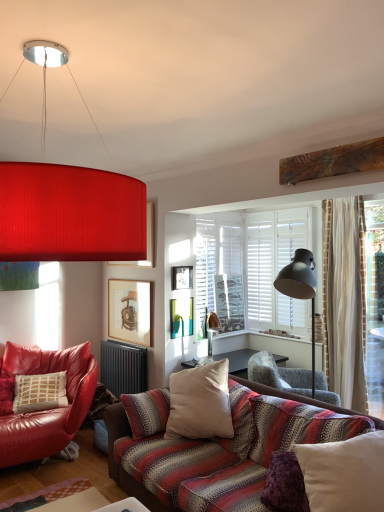
Question: Can you confirm if black metallic radiator at lower center is taller than striped fabric chair at center, which is the second chair from left to right?

Choices:
 (A) yes
 (B) no

Answer: (A)

Question: Are black metallic radiator at lower center and striped fabric chair at center, arranged as the first chair when viewed from the right, making contact?

Choices:
 (A) yes
 (B) no

Answer: (B)

Question: From a real-world perspective, is black metallic radiator at lower center positioned under striped fabric chair at center, which is the second chair from left to right, based on gravity?

Choices:
 (A) no
 (B) yes

Answer: (B)

Question: Can you confirm if black metallic radiator at lower center is positioned to the left of striped fabric chair at center, arranged as the first chair when viewed from the right?

Choices:
 (A) yes
 (B) no

Answer: (A)

Question: Considering the relative sizes of black metallic radiator at lower center and striped fabric chair at center, which is the second chair from left to right, in the image provided, is black metallic radiator at lower center wider than striped fabric chair at center, which is the second chair from left to right,?

Choices:
 (A) yes
 (B) no

Answer: (B)

Question: Is black metallic radiator at lower center positioned in front of striped fabric chair at center, which is the second chair from left to right?

Choices:
 (A) no
 (B) yes

Answer: (A)

Question: From a real-world perspective, is matte wooden picture frame at upper center, the 3th picture frame when ordered from bottom to top, positioned under matte red lampshade at upper center based on gravity?

Choices:
 (A) yes
 (B) no

Answer: (A)

Question: Considering the relative sizes of matte wooden picture frame at upper center, placed as the first picture frame when sorted from top to bottom, and matte red lampshade at upper center in the image provided, is matte wooden picture frame at upper center, placed as the first picture frame when sorted from top to bottom, bigger than matte red lampshade at upper center?

Choices:
 (A) no
 (B) yes

Answer: (A)

Question: Would you say matte red lampshade at upper center is part of matte wooden picture frame at upper center, placed as the first picture frame when sorted from top to bottom,'s contents?

Choices:
 (A) no
 (B) yes

Answer: (A)

Question: Is matte wooden picture frame at upper center, the 3th picture frame when ordered from bottom to top, smaller than matte red lampshade at upper center?

Choices:
 (A) yes
 (B) no

Answer: (A)

Question: Can you confirm if matte wooden picture frame at upper center, the 3th picture frame when ordered from bottom to top, is taller than matte red lampshade at upper center?

Choices:
 (A) yes
 (B) no

Answer: (B)

Question: From a real-world perspective, is matte wooden picture frame at upper center, placed as the first picture frame when sorted from top to bottom, located higher than matte red lampshade at upper center?

Choices:
 (A) no
 (B) yes

Answer: (A)

Question: Is black metallic radiator at lower center facing away from matte red lampshade at upper center?

Choices:
 (A) yes
 (B) no

Answer: (B)